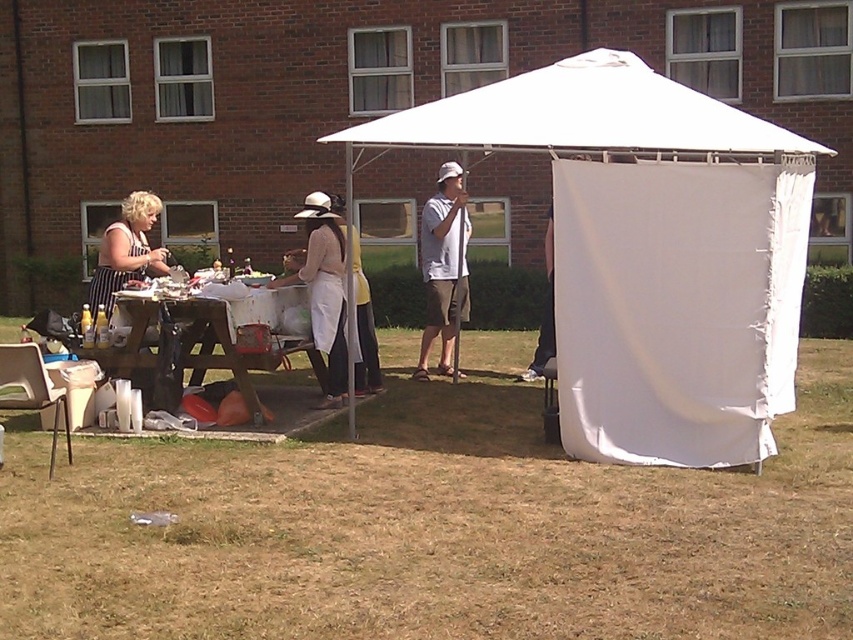
Question: From the image, what is the correct spatial relationship of white fabric tent at center in relation to white cotton dress at center?

Choices:
 (A) above
 (B) below

Answer: (A)

Question: Among these objects, which one is nearest to the camera?

Choices:
 (A) striped apron at left
 (B) white fabric tent at center
 (C) white cotton dress at center

Answer: (B)

Question: Does white fabric canopy at center have a larger size compared to white cotton dress at center?

Choices:
 (A) yes
 (B) no

Answer: (B)

Question: Which point is farther to the camera?

Choices:
 (A) (283, 349)
 (B) (734, 134)
 (C) (442, 99)
 (D) (309, 224)

Answer: (C)

Question: Which of these objects is positioned closest to the striped apron at left?

Choices:
 (A) wooden picnic table at center
 (B) white cotton dress at center
 (C) white cotton shirt at center

Answer: (A)

Question: Is white cotton dress at center above striped apron at left?

Choices:
 (A) no
 (B) yes

Answer: (A)